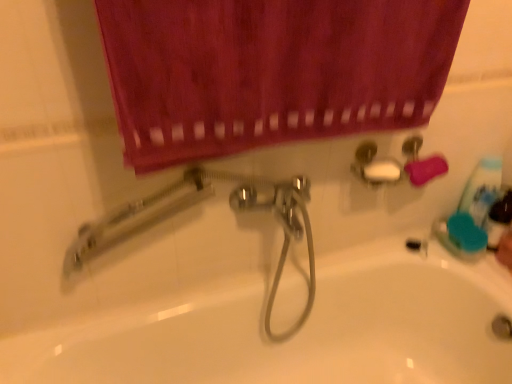
Question: Is white glossy bathtub at center aimed at smooth skin hand at lower right?

Choices:
 (A) yes
 (B) no

Answer: (B)

Question: Is white glossy bathtub at center behind smooth skin hand at lower right?

Choices:
 (A) yes
 (B) no

Answer: (B)

Question: From a real-world perspective, is white glossy bathtub at center on top of smooth skin hand at lower right?

Choices:
 (A) no
 (B) yes

Answer: (A)

Question: Is white glossy bathtub at center wider than smooth skin hand at lower right?

Choices:
 (A) yes
 (B) no

Answer: (A)

Question: Can you confirm if white glossy bathtub at center is positioned to the left of smooth skin hand at lower right?

Choices:
 (A) yes
 (B) no

Answer: (A)

Question: Which is correct: white glossy bathtub at center is inside blue plastic mouthwash at right, or outside of it?

Choices:
 (A) outside
 (B) inside

Answer: (A)

Question: From the image's perspective, is white glossy bathtub at center positioned above or below blue plastic mouthwash at right?

Choices:
 (A) below
 (B) above

Answer: (A)

Question: Considering the positions of white glossy bathtub at center and blue plastic mouthwash at right in the image, is white glossy bathtub at center wider or thinner than blue plastic mouthwash at right?

Choices:
 (A) thin
 (B) wide

Answer: (B)

Question: Considering the positions of white glossy bathtub at center and blue plastic mouthwash at right in the image, is white glossy bathtub at center taller or shorter than blue plastic mouthwash at right?

Choices:
 (A) tall
 (B) short

Answer: (A)

Question: Is velvet-like maroon curtain at upper center inside the boundaries of blue plastic mouthwash at right, or outside?

Choices:
 (A) inside
 (B) outside

Answer: (B)

Question: Based on their positions, is velvet-like maroon curtain at upper center located to the left or right of blue plastic mouthwash at right?

Choices:
 (A) right
 (B) left

Answer: (B)

Question: In terms of size, does velvet-like maroon curtain at upper center appear bigger or smaller than blue plastic mouthwash at right?

Choices:
 (A) small
 (B) big

Answer: (B)

Question: From a real-world perspective, relative to blue plastic mouthwash at right, is velvet-like maroon curtain at upper center vertically above or below?

Choices:
 (A) above
 (B) below

Answer: (A)

Question: Do you think smooth skin hand at lower right is within blue plastic mouthwash at right, or outside of it?

Choices:
 (A) inside
 (B) outside

Answer: (B)

Question: In the image, is smooth skin hand at lower right on the left side or the right side of blue plastic mouthwash at right?

Choices:
 (A) right
 (B) left

Answer: (A)